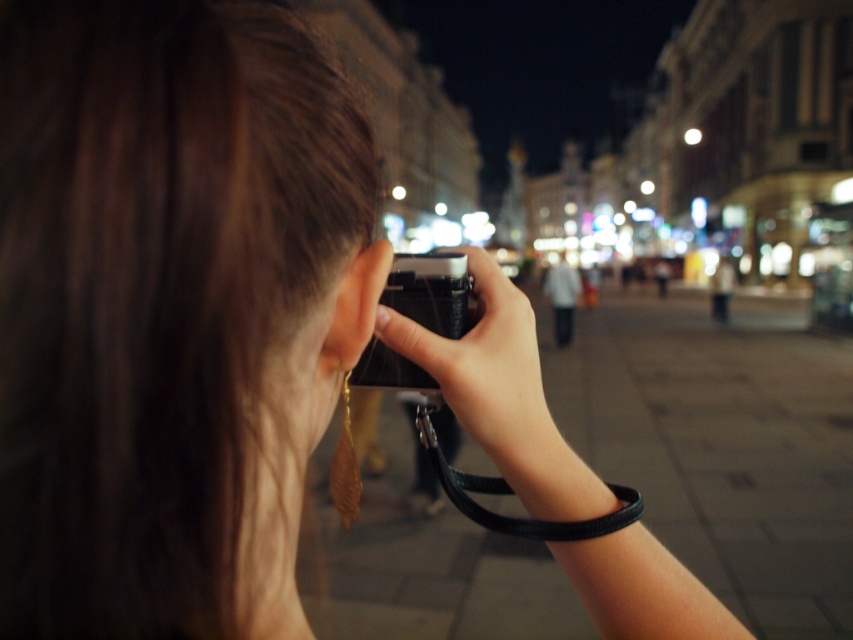
Question: Is black matte camera at center below black plastic camera at center?

Choices:
 (A) yes
 (B) no

Answer: (A)

Question: Which of the following is the closest to the observer?

Choices:
 (A) (523, 396)
 (B) (434, 296)

Answer: (A)

Question: Is black matte camera at center behind black plastic camera at center?

Choices:
 (A) yes
 (B) no

Answer: (B)

Question: Is black matte camera at center further to the viewer compared to black plastic camera at center?

Choices:
 (A) yes
 (B) no

Answer: (B)